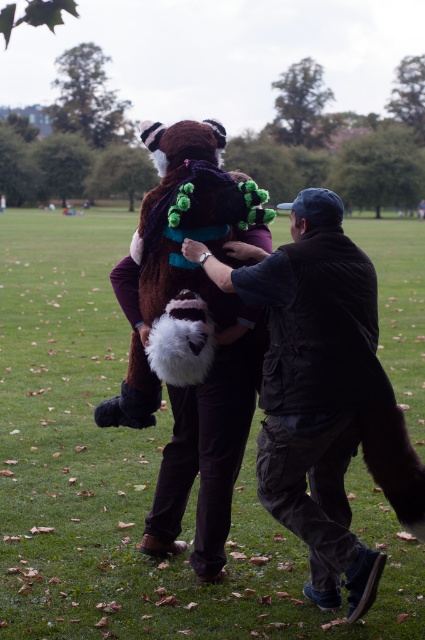
Looking at this image, is the position of dark brown leather jacket at center less distant than that of brown plush animal at center?

Yes, dark brown leather jacket at center is in front of brown plush animal at center.

I want to click on dark brown leather jacket at center, so click(323, 394).

Where is `dark brown leather jacket at center`? This screenshot has height=640, width=425. dark brown leather jacket at center is located at coordinates (323, 394).